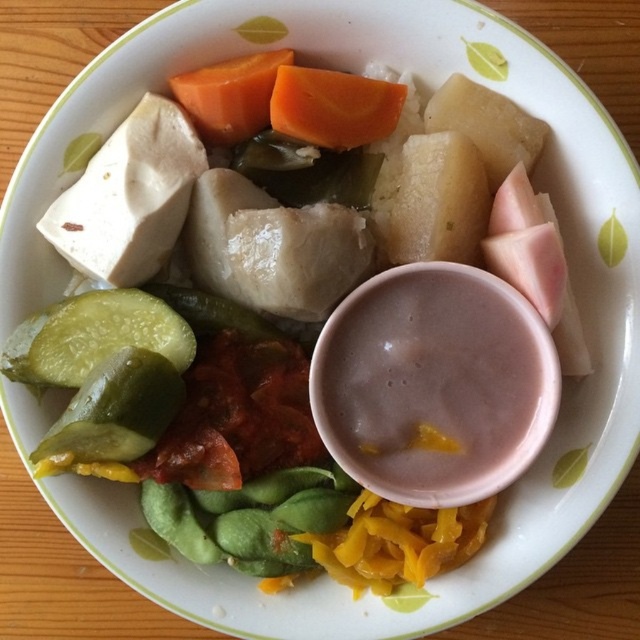
You are a food critic evaluating the presentation of this dish. The white soft tofu at upper left and the green glossy cucumber at lower left are key elements. Which of these two items is more prominent in size?

The white soft tofu at upper left is larger in size than the green glossy cucumber at lower left, making it more prominent in size.

You are a food critic evaluating the presentation of this dish. The white soft tofu at upper left and the green pickled vegetable at lower left are key elements. Based on their positions, which one is positioned to the right of the other?

The white soft tofu at upper left is to the right of the green pickled vegetable at lower left.

Which object is located at the coordinates point (93,337)?

The green glossy cucumber at lower left is located at point (93,337).